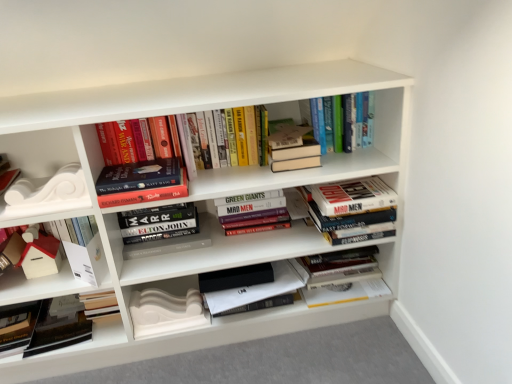
How much space does white matte bookshelf at center, marked as the first shelf in a bottom-to-top arrangement, occupy vertically?

white matte bookshelf at center, marked as the first shelf in a bottom-to-top arrangement, is 86.07 centimeters in height.

This screenshot has height=384, width=512. What are the coordinates of `black matte book at lower left, the 9th book viewed from the right` in the screenshot? It's located at (60, 325).

At what (x,y) coordinates should I click in order to perform the action: click on hardcover books at center, which ranks as the sixth book in left-to-right order. Please return your answer as a coordinate pair (x, y). The width and height of the screenshot is (512, 384). Looking at the image, I should click on (253, 214).

Where is `hardcover books at center, which is counted as the 2th book, starting from the right`? hardcover books at center, which is counted as the 2th book, starting from the right is located at coordinates (354, 210).

What is the approximate height of hardcover books at center, which is counted as the 2th book, starting from the right?

The height of hardcover books at center, which is counted as the 2th book, starting from the right, is 18.35 centimeters.

This screenshot has width=512, height=384. In order to click on hardcover books at center, placed as the 7th book when sorted from right to left in this screenshot , I will do `click(169, 239)`.

What do you see at coordinates (247, 133) in the screenshot? I see `hardcover books at upper center, which is the 6th book from right to left` at bounding box center [247, 133].

Describe the element at coordinates (343, 281) in the screenshot. I see `hardcover books at center, which ranks as the tenth book in left-to-right order` at that location.

Identify the location of white matte house at left, acting as the 10th book starting from the right. (68, 254).

Is white matte house at left, the first book from the left, with hardcover books at center, which ranks as the tenth book in left-to-right order?

There is a gap between white matte house at left, the first book from the left, and hardcover books at center, which ranks as the tenth book in left-to-right order.

At what (x,y) coordinates should I click in order to perform the action: click on the 5th book in front of the hardcover books at center, which ranks as the tenth book in left-to-right order. Please return your answer as a coordinate pair (x, y). Looking at the image, I should click on (68, 254).

Based on the photo, is hardcover books at center, acting as the first book starting from the right, located within white matte house at left, acting as the 10th book starting from the right?

No, hardcover books at center, acting as the first book starting from the right, is not surrounded by white matte house at left, acting as the 10th book starting from the right.

Looking at this image, is white matte house at left, the first book from the left, to the right of hardcover books at center, which ranks as the tenth book in left-to-right order, from the viewer's perspective?

In fact, white matte house at left, the first book from the left, is to the left of hardcover books at center, which ranks as the tenth book in left-to-right order.

Is white matte bookshelf at center, which is the 2th shelf from top to bottom, bigger than hardcover books at upper center, which ranks as the third book in right-to-left order?

Correct, white matte bookshelf at center, which is the 2th shelf from top to bottom, is larger in size than hardcover books at upper center, which ranks as the third book in right-to-left order.

You are a GUI agent. You are given a task and a screenshot of the screen. Output one action in this format:
    pyautogui.click(x=<x>, y=<y>)
    Task: Click on the 6th book directly above the white matte bookshelf at center, which is the first shelf in right-to-left order (from a real-world perspective)
    The height and width of the screenshot is (384, 512).
    Given the screenshot: What is the action you would take?
    pyautogui.click(x=343, y=121)

Is point (196, 104) less distant than point (338, 151)?

Yes, point (196, 104) is closer to viewer.

Is white matte decorative molding at lower left, which is the first paperback book from right to left, completely or partially inside hardcover book at center, which is counted as the eighth book, starting from the right?

No, white matte decorative molding at lower left, which is the first paperback book from right to left, is not inside hardcover book at center, which is counted as the eighth book, starting from the right.

Is hardcover book at center, which is counted as the eighth book, starting from the right, wider than white matte decorative molding at lower left, which is the first paperback book from right to left?

Yes.

Is white matte decorative molding at lower left, which is the first paperback book from right to left, at the back of hardcover book at center, the third book viewed from the left?

hardcover book at center, the third book viewed from the left, is not turned away from white matte decorative molding at lower left, which is the first paperback book from right to left.

From a real-world perspective, is hardcover books at upper center, which ranks as the third book in right-to-left order, above or below white matte decorative element at left, which ranks as the second shelf in bottom-to-top order?

Clearly, from a real-world perspective, hardcover books at upper center, which ranks as the third book in right-to-left order, is above white matte decorative element at left, which ranks as the second shelf in bottom-to-top order.

Looking at the image, does hardcover books at upper center, which ranks as the third book in right-to-left order, seem bigger or smaller compared to white matte decorative element at left, the 1th shelf positioned from the left?

In the image, hardcover books at upper center, which ranks as the third book in right-to-left order, appears to be larger than white matte decorative element at left, the 1th shelf positioned from the left.

How much distance is there between hardcover books at upper center, the eighth book in the left-to-right sequence, and white matte decorative element at left, which appears as the second shelf when viewed from the right?

A: 85.04 centimeters.

Which is in front, hardcover books at center, the 9th book in the left-to-right sequence, or matte black book at lower left, the 3th paperback book positioned from the right?

hardcover books at center, the 9th book in the left-to-right sequence, is closer to the camera.

Which is correct: hardcover books at center, the 9th book in the left-to-right sequence, is inside matte black book at lower left, which is counted as the 1th paperback book, starting from the left, or outside of it?

hardcover books at center, the 9th book in the left-to-right sequence, cannot be found inside matte black book at lower left, which is counted as the 1th paperback book, starting from the left.

I want to click on paperback book that is the 3rd one when counting downward from the hardcover books at center, the 9th book in the left-to-right sequence (from the image's perspective), so click(17, 327).

How much distance is there between hardcover books at upper center, the eighth book in the left-to-right sequence, and black matte book at lower left, the second book from the left?

hardcover books at upper center, the eighth book in the left-to-right sequence, and black matte book at lower left, the second book from the left, are 3.54 feet apart.

Does hardcover books at upper center, which ranks as the third book in right-to-left order, touch black matte book at lower left, the second book from the left?

No, hardcover books at upper center, which ranks as the third book in right-to-left order, is not beside black matte book at lower left, the second book from the left.

Could you tell me if hardcover books at upper center, the eighth book in the left-to-right sequence, is turned towards black matte book at lower left, the 9th book viewed from the right?

No, hardcover books at upper center, the eighth book in the left-to-right sequence, is not facing towards black matte book at lower left, the 9th book viewed from the right.

Which is in front, point (346, 120) or point (45, 320)?

Point (346, 120)

Which object is wider, hardcover books at center, the 9th book in the left-to-right sequence, or hardcover books at upper center, which is the 6th book from right to left?

Wider between the two is hardcover books at center, the 9th book in the left-to-right sequence.

Is hardcover books at center, the 9th book in the left-to-right sequence, with hardcover books at upper center, the fifth book from the left?

No.

Can you tell me how much hardcover books at center, the 9th book in the left-to-right sequence, and hardcover books at upper center, the fifth book from the left, differ in facing direction?

There is a 2.31-degree angle between the facing directions of hardcover books at center, the 9th book in the left-to-right sequence, and hardcover books at upper center, the fifth book from the left.

From the hardcover books at center, acting as the first book starting from the right, count 5th books forward and point to it. Please provide its 2D coordinates.

[(68, 254)]

Find the location of a particular element. This screenshot has height=384, width=512. shelf that is the 2nd one when counting downward from the hardcover books at upper center, which ranks as the third book in right-to-left order (from the image's perspective) is located at coordinates (200, 194).

Based on their spatial positions, is hardcover books at center, which ranks as the sixth book in left-to-right order, or white matte decorative molding at lower left, which appears as the 3th paperback book when viewed from the left, further from hardcover books at center, placed as the 7th book when sorted from right to left?

white matte decorative molding at lower left, which appears as the 3th paperback book when viewed from the left.

Looking at the image, which one is located further to white matte paper at lower left, arranged as the second paperback book when viewed from the right, hardcover books at upper center, the eighth book in the left-to-right sequence, or hardcover books at upper center, which is the 6th book from right to left?

hardcover books at upper center, the eighth book in the left-to-right sequence, is further to white matte paper at lower left, arranged as the second paperback book when viewed from the right.

Estimate the real-world distances between objects in this image. Which object is further from white matte decorative element at left, which ranks as the second shelf in bottom-to-top order, black matte book at lower left, the 9th book viewed from the right, or hardcover books at center, which ranks as the tenth book in left-to-right order?

The object further to white matte decorative element at left, which ranks as the second shelf in bottom-to-top order, is hardcover books at center, which ranks as the tenth book in left-to-right order.

Which object lies further to the anchor point hardcover books at upper center, which is the 6th book from right to left, hardcover books at upper center, the eighth book in the left-to-right sequence, or white matte decorative molding at lower left, which appears as the 3th paperback book when viewed from the left?

The object further to hardcover books at upper center, which is the 6th book from right to left, is white matte decorative molding at lower left, which appears as the 3th paperback book when viewed from the left.

Which object lies nearer to the anchor point hardcover books at upper center, which is the 6th book from right to left, white matte house at left, the first book from the left, or hardcover book at center, marked as the seventh book in a left-to-right arrangement?

Among the two, hardcover book at center, marked as the seventh book in a left-to-right arrangement, is located nearer to hardcover books at upper center, which is the 6th book from right to left.

Which object lies further to the anchor point hardcover book at center, marked as the seventh book in a left-to-right arrangement, white matte bookshelf at center, which is the second shelf from left to right, or hardcover book at center, which is counted as the eighth book, starting from the right?

Based on the image, hardcover book at center, which is counted as the eighth book, starting from the right, appears to be further to hardcover book at center, marked as the seventh book in a left-to-right arrangement.

From the image, which object appears to be farther from white matte decorative element at left, the 1th shelf positioned from the left, hardcover books at upper center, which ranks as the third book in right-to-left order, or black matte book at lower left, the 9th book viewed from the right?

hardcover books at upper center, which ranks as the third book in right-to-left order.

Looking at the image, which one is located further to hardcover books at upper center, the fifth book from the left, hardcover books at center, the fifth book when ordered from right to left, or hardcover books at center, which is counted as the 2th book, starting from the right?

hardcover books at center, which is counted as the 2th book, starting from the right.

Image resolution: width=512 pixels, height=384 pixels. Find the location of `paperback book between matte black book at lower left, which is counted as the 1th paperback book, starting from the left, and white matte decorative molding at lower left, which appears as the 3th paperback book when viewed from the left`. paperback book between matte black book at lower left, which is counted as the 1th paperback book, starting from the left, and white matte decorative molding at lower left, which appears as the 3th paperback book when viewed from the left is located at coordinates (87, 261).

The width and height of the screenshot is (512, 384). Find the location of `shelf situated between white matte paper at lower left, arranged as the second paperback book when viewed from the right, and hardcover books at center, the fifth book when ordered from right to left, from left to right`. shelf situated between white matte paper at lower left, arranged as the second paperback book when viewed from the right, and hardcover books at center, the fifth book when ordered from right to left, from left to right is located at coordinates (200, 194).

Where is `paperback book between white matte decorative element at left, the 1th shelf positioned from the left, and white matte decorative molding at lower left, which appears as the 3th paperback book when viewed from the left, in the vertical direction`? The height and width of the screenshot is (384, 512). paperback book between white matte decorative element at left, the 1th shelf positioned from the left, and white matte decorative molding at lower left, which appears as the 3th paperback book when viewed from the left, in the vertical direction is located at coordinates (87, 261).

You are a GUI agent. You are given a task and a screenshot of the screen. Output one action in this format:
    pyautogui.click(x=<x>, y=<y>)
    Task: Click on the book situated between white matte decorative element at left, which ranks as the second shelf in bottom-to-top order, and hardcover books at center, placed as the 7th book when sorted from right to left, from left to right
    This screenshot has height=384, width=512.
    Given the screenshot: What is the action you would take?
    pyautogui.click(x=141, y=182)